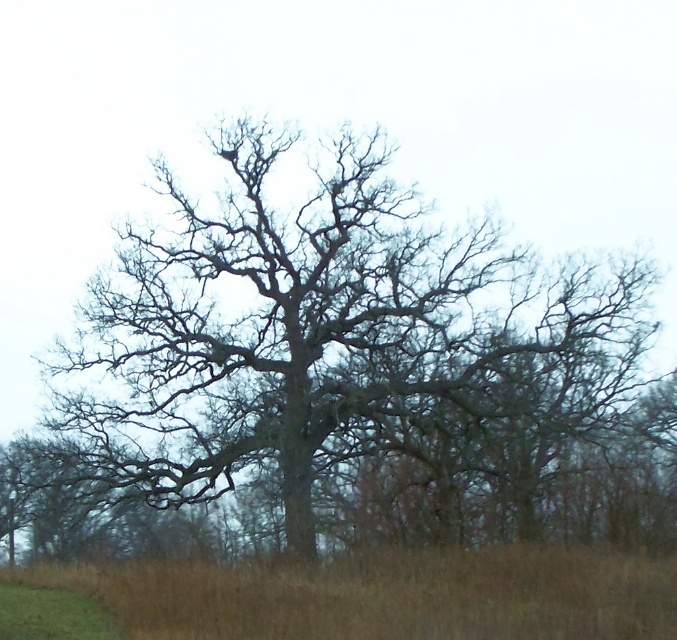
Question: Is bare wood tree at center smaller than brown grass at lower center?

Choices:
 (A) no
 (B) yes

Answer: (A)

Question: Which point is farther to the camera?

Choices:
 (A) brown grass at lower center
 (B) bare wood tree at center

Answer: (B)

Question: Can you confirm if bare wood tree at center is positioned to the right of brown grass at lower center?

Choices:
 (A) no
 (B) yes

Answer: (B)

Question: Which point is closer to the camera?

Choices:
 (A) (286, 616)
 (B) (238, 145)

Answer: (A)

Question: Does bare wood tree at center have a lesser width compared to brown grass at lower center?

Choices:
 (A) yes
 (B) no

Answer: (B)